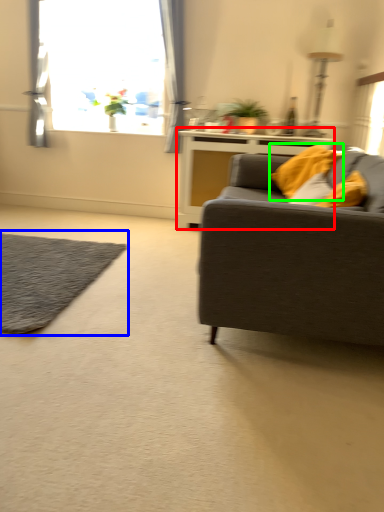
Question: Which object is positioned closest to table (highlighted by a red box)? Select from mat (highlighted by a blue box) and pillow (highlighted by a green box).

Choices:
 (A) mat
 (B) pillow

Answer: (B)